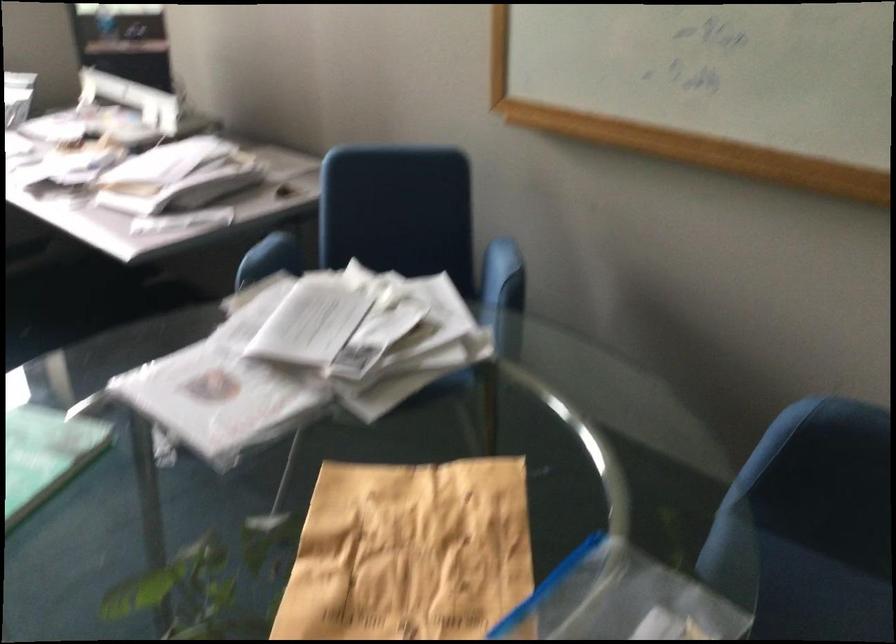
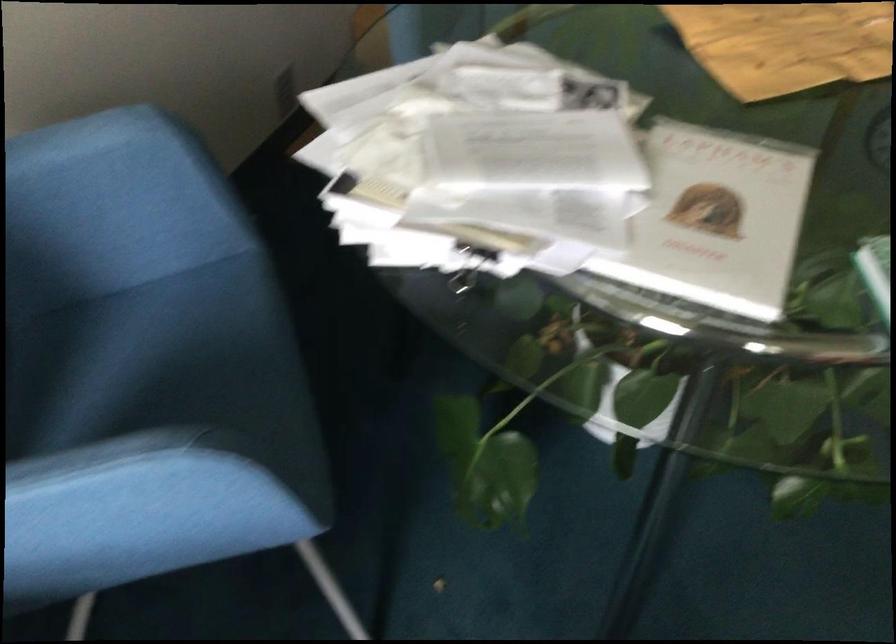
The point at [385,574] is marked in the first image. Where is the corresponding point in the second image?

(786, 44)